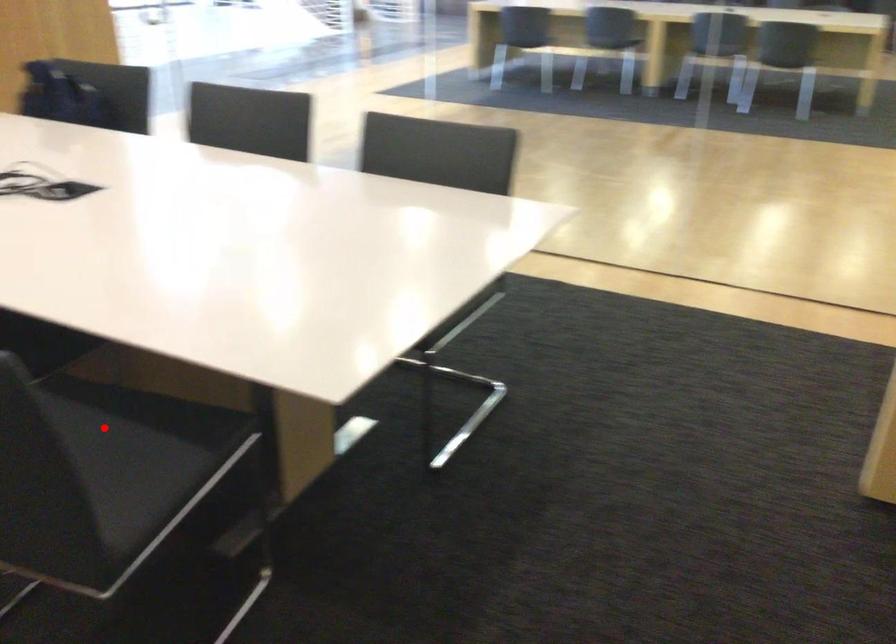
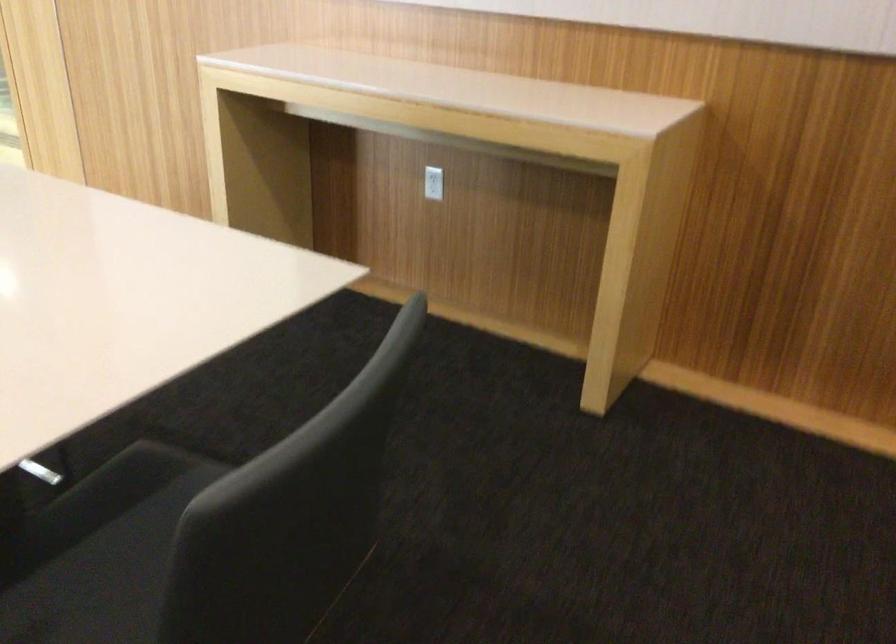
Question: I am providing you with two images of the same scene from different viewpoints. Given a red point in image1, look at the same physical point in image2. Is it:

Choices:
 (A) Closer to the viewpoint
 (B) Farther from the viewpoint

Answer: (A)